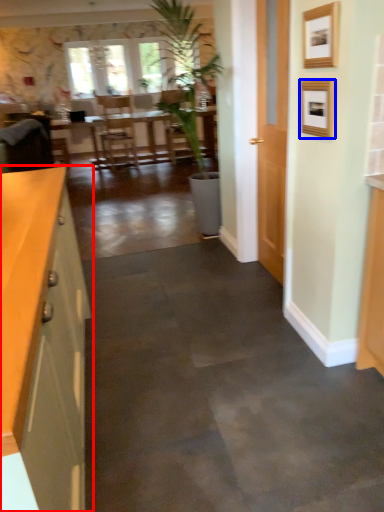
Question: Which object is closer to the camera taking this photo, cabinetry (highlighted by a red box) or picture frame (highlighted by a blue box)?

Choices:
 (A) cabinetry
 (B) picture frame

Answer: (A)